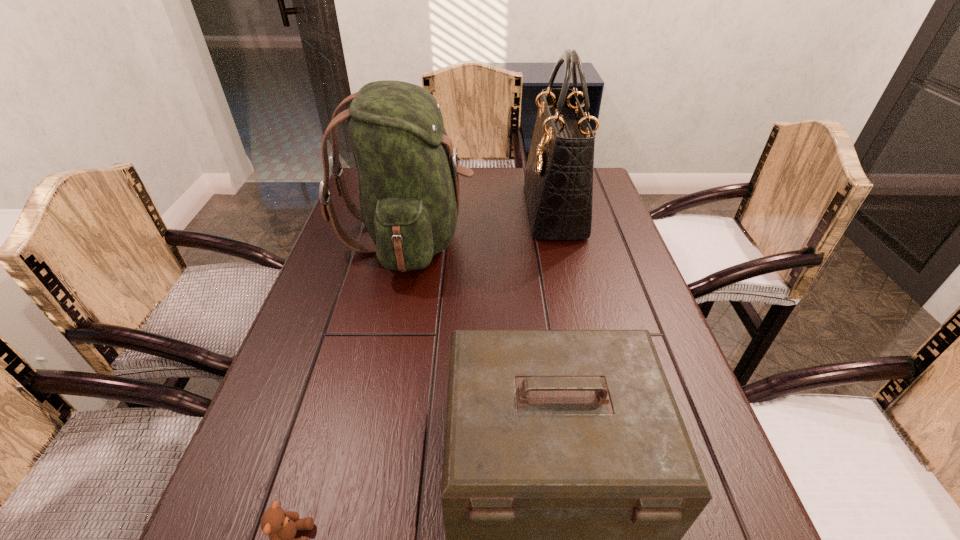
Find the location of a particular element. handbag is located at coordinates point(558,179).

Find the location of `backpack`. backpack is located at coordinates (408, 172).

This screenshot has height=540, width=960. I want to click on vacant region located at the front of the handbag with visible charms, so point(498,210).

The width and height of the screenshot is (960, 540). What are the coordinates of `vacant space positioned 0.070m at the front of the handbag with visible charms` in the screenshot? It's located at (505, 210).

This screenshot has width=960, height=540. Find the location of `free region located at the front of the handbag with visible charms`. free region located at the front of the handbag with visible charms is located at coordinates point(435,210).

At what (x,y) coordinates should I click in order to perform the action: click on vacant space located 0.220m on the open flap of the backpack. Please return your answer as a coordinate pair (x, y). This screenshot has width=960, height=540. Looking at the image, I should click on (551, 237).

You are a GUI agent. You are given a task and a screenshot of the screen. Output one action in this format:
    pyautogui.click(x=<x>, y=<y>)
    Task: Click on the handbag that is at the far edge
    
    Given the screenshot: What is the action you would take?
    pyautogui.click(x=558, y=179)

The width and height of the screenshot is (960, 540). Identify the location of backpack that is at the far edge. (408, 172).

Where is `object that is at the left edge`? This screenshot has height=540, width=960. object that is at the left edge is located at coordinates (408, 172).

You are a GUI agent. You are given a task and a screenshot of the screen. Output one action in this format:
    pyautogui.click(x=<x>, y=<y>)
    Task: Click on the object located in the right edge section of the desktop
    
    Given the screenshot: What is the action you would take?
    pyautogui.click(x=558, y=179)